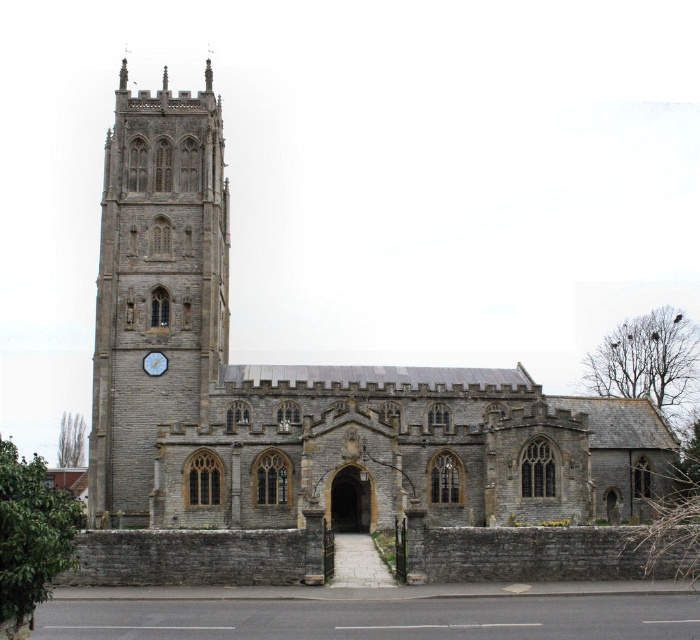
This screenshot has width=700, height=640. What do you see at coordinates (155, 285) in the screenshot? I see `gray stone tower at left` at bounding box center [155, 285].

Which is below, gray stone tower at left or blue painted wood clock at left?

blue painted wood clock at left is lower down.

Is point (214, 205) closer to viewer compared to point (160, 371)?

No, (214, 205) is behind (160, 371).

Where is `gray stone tower at left`? gray stone tower at left is located at coordinates (155, 285).

Is point (522, 396) positioned after point (158, 358)?

Yes, it is.

What do you see at coordinates (309, 410) in the screenshot? I see `gray stone church at center` at bounding box center [309, 410].

This screenshot has width=700, height=640. Find the location of `gray stone church at center`. gray stone church at center is located at coordinates (309, 410).

Can you confirm if gray stone church at center is thinner than gray stone tower at left?

No.

Based on the photo, between gray stone church at center and gray stone tower at left, which one has less height?

Standing shorter between the two is gray stone tower at left.

Does point (486, 396) lie in front of point (133, 413)?

No, it is behind (133, 413).

Where is `gray stone church at center`? The width and height of the screenshot is (700, 640). gray stone church at center is located at coordinates (309, 410).